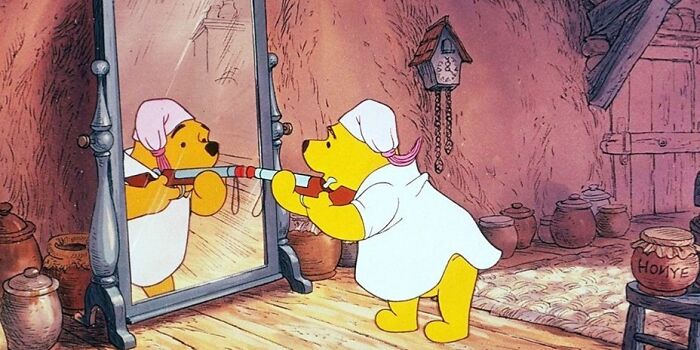
You are a GUI agent. You are given a task and a screenshot of the screen. Output one action in this format:
    pyautogui.click(x=<x>, y=<y>)
    Task: Click on the gray stool
    
    Given the screenshot: What is the action you would take?
    pyautogui.click(x=680, y=304)